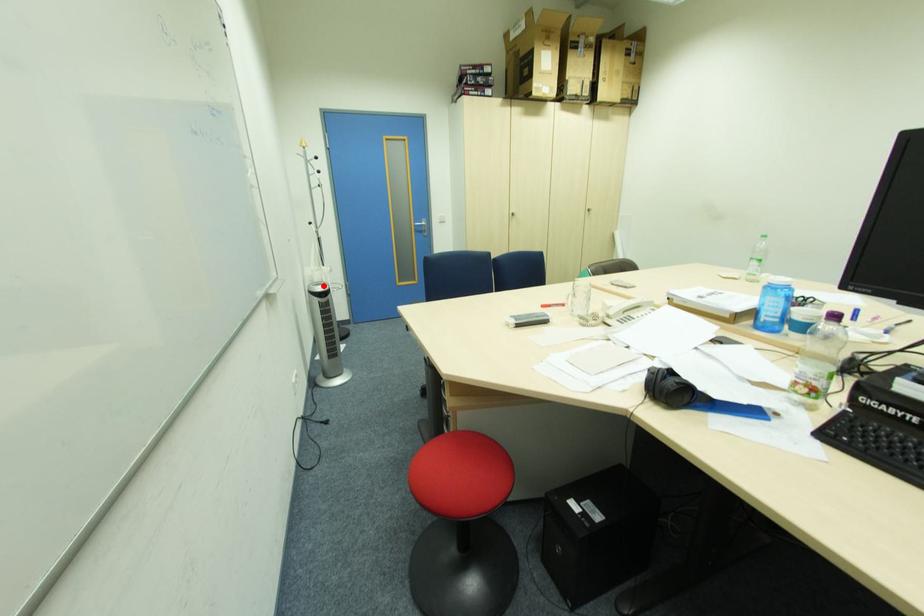
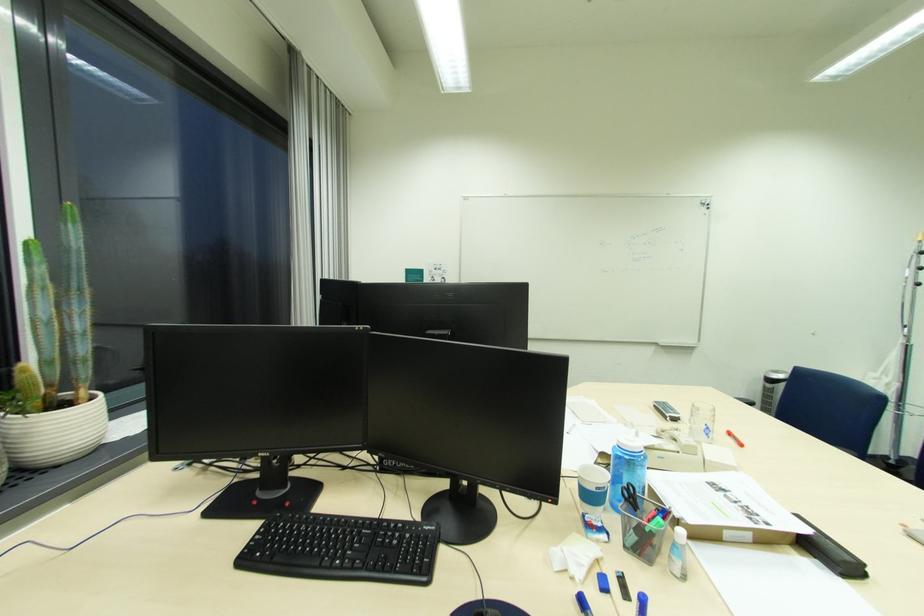
Question: A red point is marked in image1. In image2, is the corresponding 3D point closer to the camera or farther? Reply with the corresponding letter.

Choices:
 (A) The corresponding 3D point is closer.
 (B) The corresponding 3D point is farther.

Answer: (B)